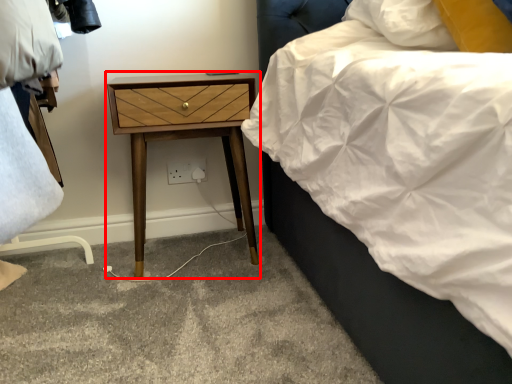
Question: From the image's perspective, considering the relative positions of nightstand (annotated by the red box) and electric outlet in the image provided, where is nightstand (annotated by the red box) located with respect to the staircase?

Choices:
 (A) above
 (B) below

Answer: (A)